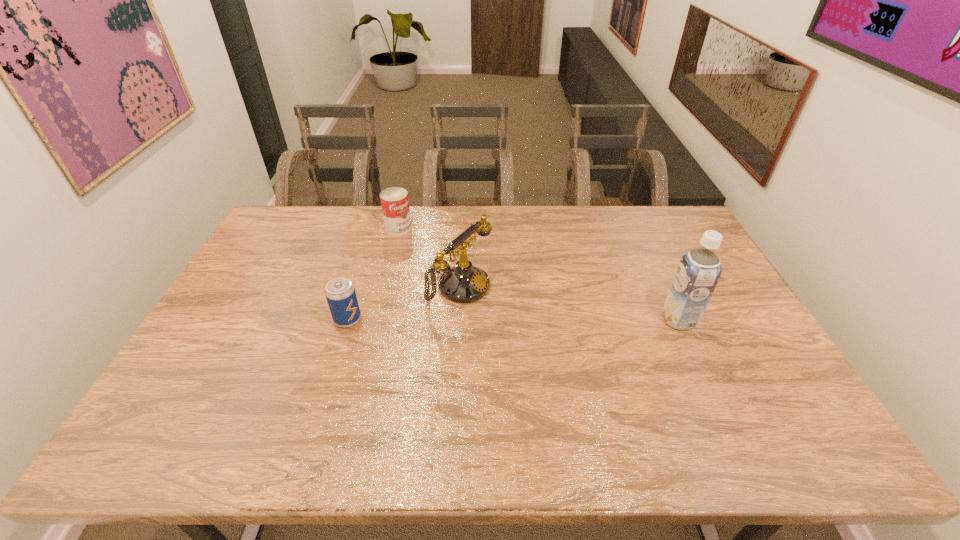
Where is `beer can`? This screenshot has height=540, width=960. beer can is located at coordinates (340, 293).

What are the coordinates of `the rightmost object` in the screenshot? It's located at (699, 270).

I want to click on the tallest object, so click(x=699, y=270).

Locate an element on the screen. the third shortest object is located at coordinates (464, 283).

The height and width of the screenshot is (540, 960). Identify the location of telephone. (464, 283).

At what (x,y) coordinates should I click in order to perform the action: click on the farthest object. Please return your answer as a coordinate pair (x, y). The height and width of the screenshot is (540, 960). Looking at the image, I should click on [x=394, y=201].

In order to click on free space located 0.070m on the left of the beer can in this screenshot , I will do `click(310, 320)`.

Where is `free space located on the label of the rightmost object`? This screenshot has width=960, height=540. free space located on the label of the rightmost object is located at coordinates (642, 320).

Find the location of a particular element. Image resolution: width=960 pixels, height=540 pixels. vacant space located 0.310m on the label of the rightmost object is located at coordinates (556, 320).

Image resolution: width=960 pixels, height=540 pixels. What are the coordinates of `free spot located 0.220m on the label of the rightmost object` in the screenshot? It's located at (588, 320).